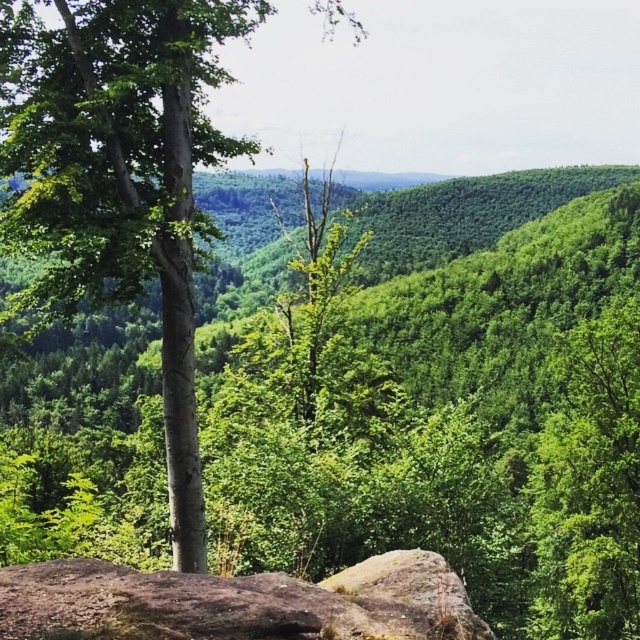
Question: Does green matte tree at center have a smaller size compared to brown rough rock at lower center?

Choices:
 (A) no
 (B) yes

Answer: (A)

Question: Is green matte tree at center in front of brown rough rock at lower center?

Choices:
 (A) no
 (B) yes

Answer: (A)

Question: Can you confirm if green matte tree at center is positioned below brown rough rock at lower center?

Choices:
 (A) yes
 (B) no

Answer: (B)